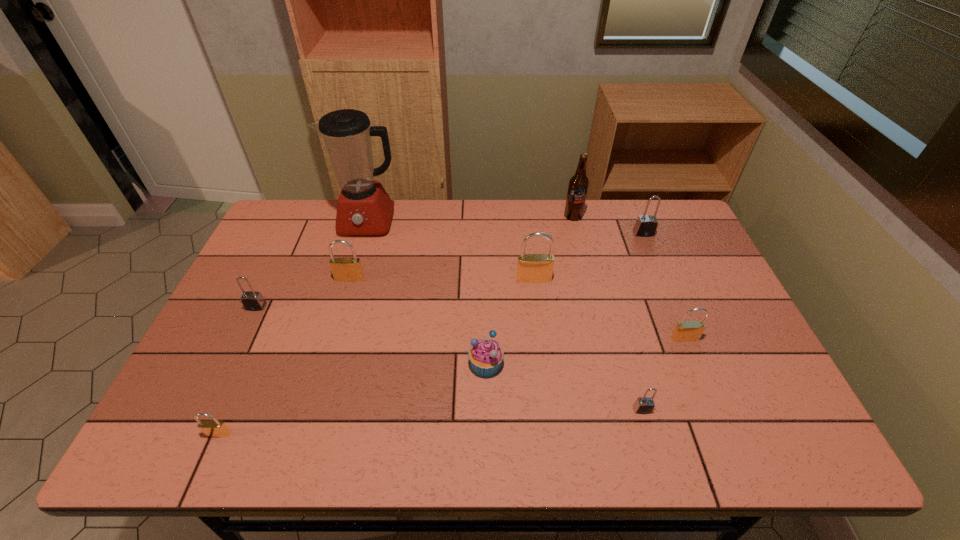
What are the coordinates of `free space that is in between the leftmost gray padlock and the tallest object` in the screenshot? It's located at (312, 265).

Identify the location of vacant point located between the third padlock from left to right and the rightmost gray padlock. The image size is (960, 540). (496, 256).

The image size is (960, 540). In order to click on unoccupied position between the biggest gray padlock and the muffin in this screenshot , I will do `click(564, 299)`.

The width and height of the screenshot is (960, 540). Find the location of `vacant point located between the tallest object and the leftmost gray padlock`. vacant point located between the tallest object and the leftmost gray padlock is located at coordinates tap(312, 265).

Find the location of a particular element. The width and height of the screenshot is (960, 540). vacant region between the second smallest gray padlock and the tallest object is located at coordinates (312, 265).

This screenshot has height=540, width=960. I want to click on the closest object relative to the beer bottle, so click(x=646, y=225).

Choose which object is the seventh nearest neighbor to the tallest padlock. Please provide its 2D coordinates. Your answer should be formatted as a tuple, i.e. [(x, y)], where the tuple contains the x and y coordinates of a point satisfying the conditions above.

[(346, 269)]

Identify the location of the fifth closest padlock to the leftmost brass padlock. (685, 331).

At what (x,y) coordinates should I click in order to perform the action: click on padlock identified as the second closest to the third brass padlock from right to left. Please return your answer as a coordinate pair (x, y). The image size is (960, 540). Looking at the image, I should click on (531, 268).

Choose which brass padlock is the second nearest neighbor to the biggest gray padlock. Please provide its 2D coordinates. Your answer should be formatted as a tuple, i.e. [(x, y)], where the tuple contains the x and y coordinates of a point satisfying the conditions above.

[(685, 331)]